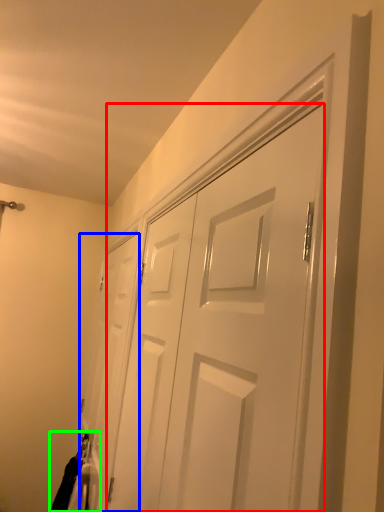
Question: Which is farther away from door (highlighted by a red box)? door (highlighted by a blue box) or laundry (highlighted by a green box)?

Choices:
 (A) door
 (B) laundry

Answer: (B)